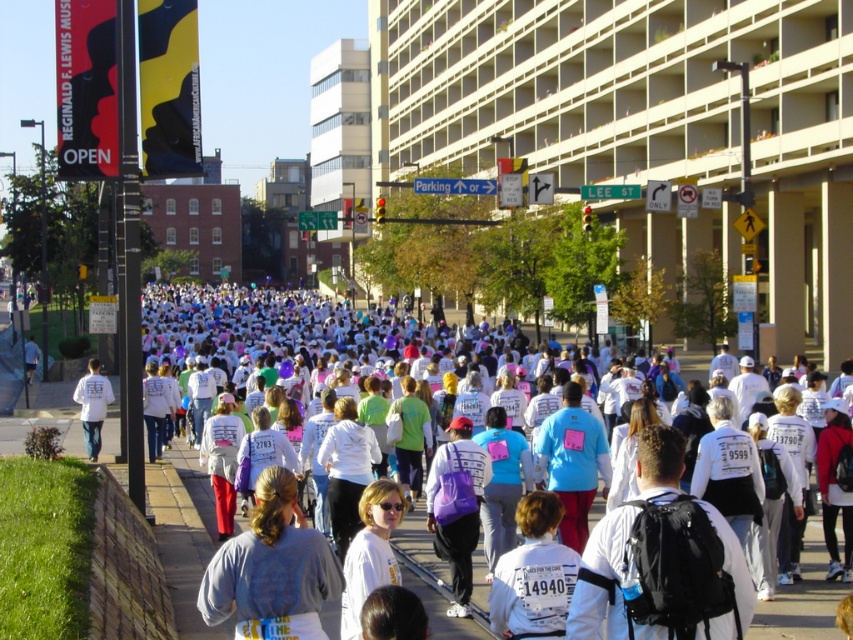
You are a photographer at the event and want to capture both the gray cotton shirt at lower left and the purple fabric bag at center in a single photo. Which object should you focus on first to ensure both are in frame?

You should focus on the purple fabric bag at center first because the gray cotton shirt at lower left is not as tall as it, ensuring both will fit within the frame.

You are standing at the starting line of the event and notice a participant wearing the gray cotton shirt at lower left. Where exactly is this participant located relative to the starting line?

The gray cotton shirt at lower left is located at point 0.891 on the x axis and 0.320 on the y axis relative to the starting line.